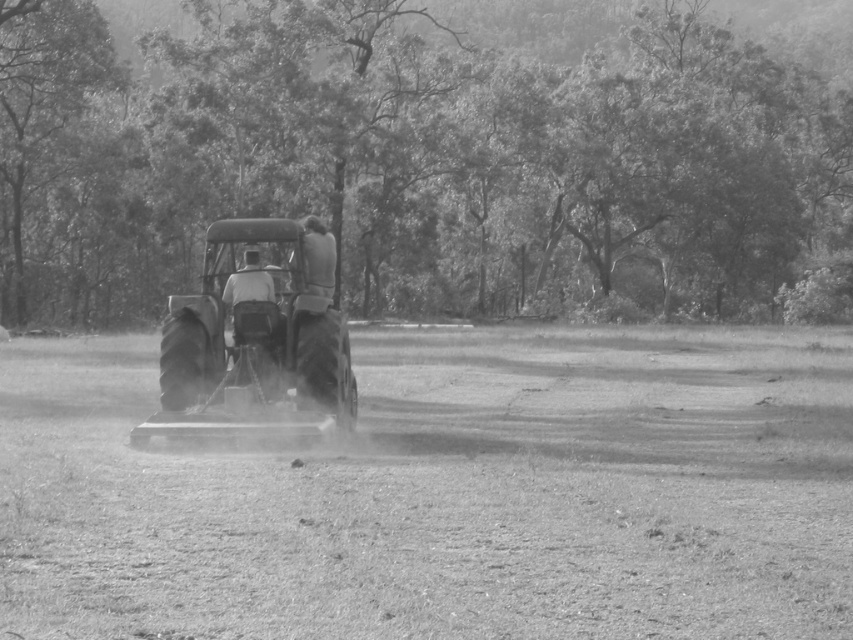
Where is `dusty soil at center`? This screenshot has height=640, width=853. dusty soil at center is located at coordinates (447, 493).

Looking at this image, which is above, dusty soil at center or dark gray fabric shirt at center?

dark gray fabric shirt at center is above.

Is point (82, 621) farther from viewer compared to point (306, 243)?

No.

What are the coordinates of `dusty soil at center` in the screenshot? It's located at (447, 493).

Who is lower down, metallic tractor at center or dark gray fabric shirt at center?

metallic tractor at center is below.

Who is more forward, (328, 364) or (334, 259)?

Point (328, 364)

Where is `metallic tractor at center`? This screenshot has width=853, height=640. metallic tractor at center is located at coordinates (256, 339).

Between dusty soil at center and metallic tractor at center, which one appears on the left side from the viewer's perspective?

metallic tractor at center

Between dusty soil at center and metallic tractor at center, which one is positioned lower?

dusty soil at center is below.

Describe the element at coordinates (447, 493) in the screenshot. I see `dusty soil at center` at that location.

The width and height of the screenshot is (853, 640). I want to click on dusty soil at center, so click(447, 493).